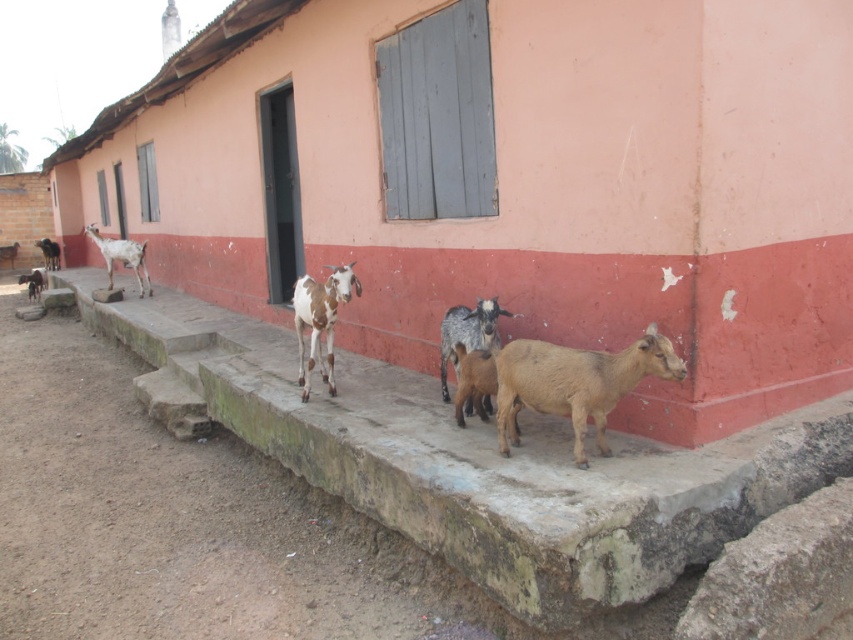
You are a farmer who needs to separate the goats based on their positions. Which goat is positioned to the right side of the other between the white spotted fur goat at center and the white speckled fur goat at left?

The white spotted fur goat at center is positioned to the right of the white speckled fur goat at left.

You are a goat herder trying to guide your goats to a safer area. You notice the brown speckled goat at left is near the concrete ledge at center. Based on the scene, is the goat above or below the ledge?

The brown speckled goat at left is above the concrete ledge at center since the ledge is below the goat.

You are a farmer who needs to choose a goat for milking. You have to pick the one that can produce more milk based on their size. Which goat should you choose between the white spotted fur goat at center and the white speckled fur goat at left?

The white spotted fur goat at center has a larger size compared to the white speckled fur goat at left, so it is more likely to produce more milk.